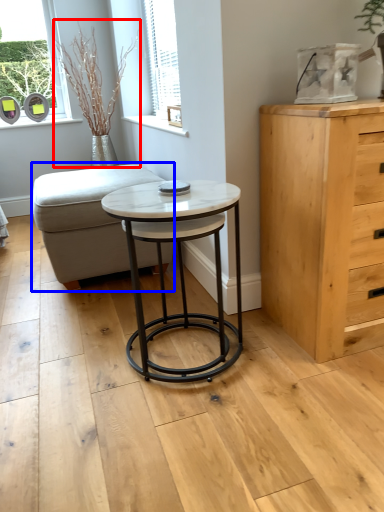
Question: Among these objects, which one is nearest to the camera, plant (highlighted by a red box) or swivel chair (highlighted by a blue box)?

Choices:
 (A) plant
 (B) swivel chair

Answer: (B)